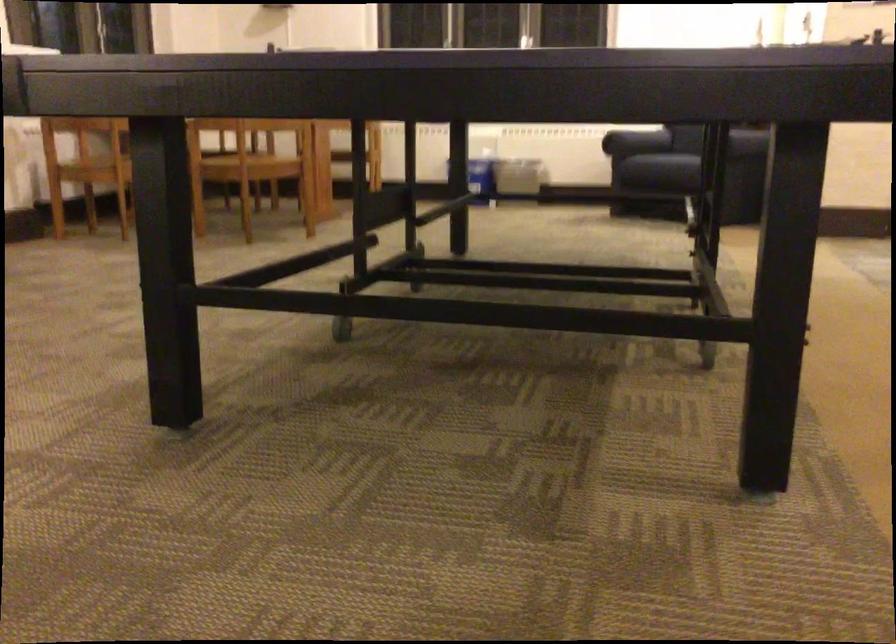
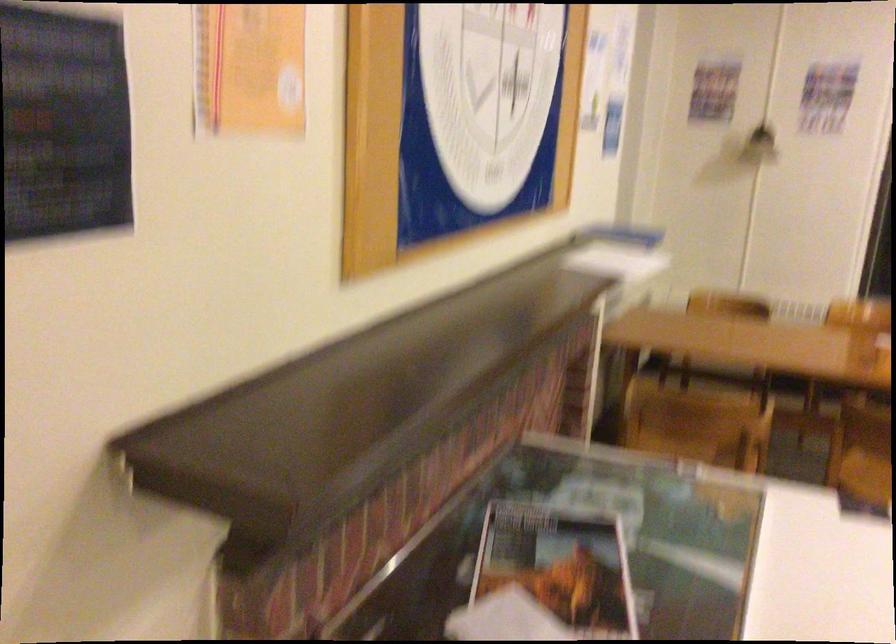
The images are taken continuously from a first-person perspective. In which direction are you moving?

The cameraman moved toward left, forward.